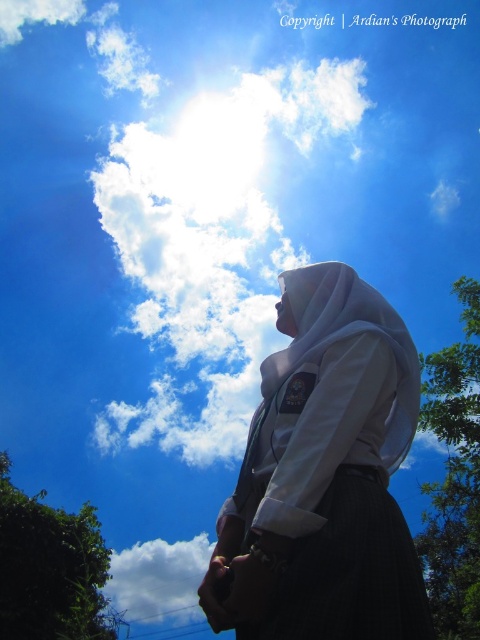
You are a photographer trying to capture the scene with the white matte uniform at center and the white fluffy cloud at lower left. Based on their positions, which object is closer to the right side of the photo?

The white matte uniform at center is to the right of the white fluffy cloud at lower left, so it is closer to the right side of the photo.

You are standing in the scene and want to locate the white matte uniform at center. According to the coordinates provided, where should you look?

The white matte uniform at center is located at the coordinates point (324, 476).